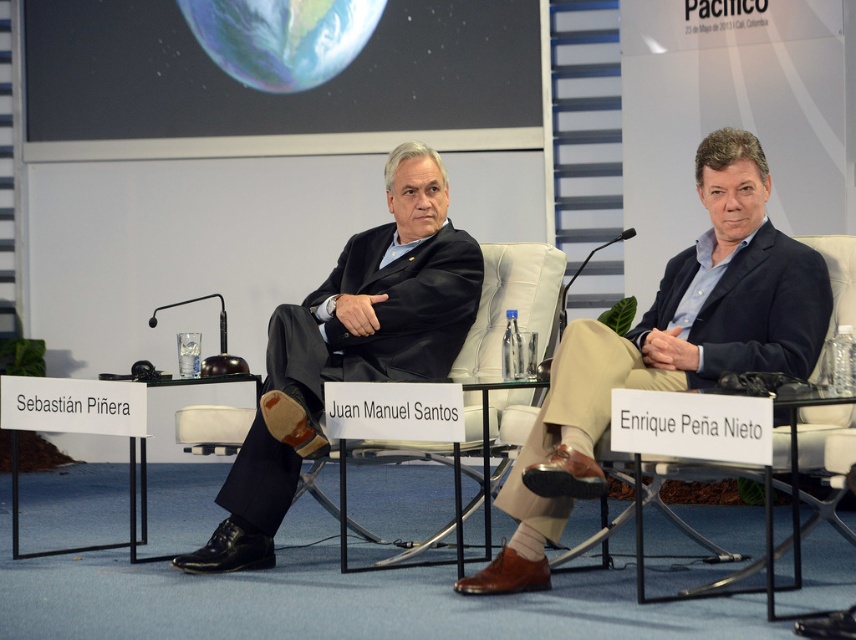
Question: Can you confirm if matte black suit at center is positioned above black matte suit at center?

Choices:
 (A) no
 (B) yes

Answer: (A)

Question: Is matte black suit at center wider than black matte suit at center?

Choices:
 (A) no
 (B) yes

Answer: (B)

Question: Is matte black suit at center to the left of black matte suit at center from the viewer's perspective?

Choices:
 (A) yes
 (B) no

Answer: (B)

Question: Which object is farther from the camera taking this photo?

Choices:
 (A) black matte suit at center
 (B) matte black suit at center

Answer: (A)

Question: Which of the following is the closest to the observer?

Choices:
 (A) (455, 352)
 (B) (804, 368)

Answer: (B)

Question: Which point appears farthest from the camera in this image?

Choices:
 (A) (566, 502)
 (B) (343, 273)

Answer: (B)